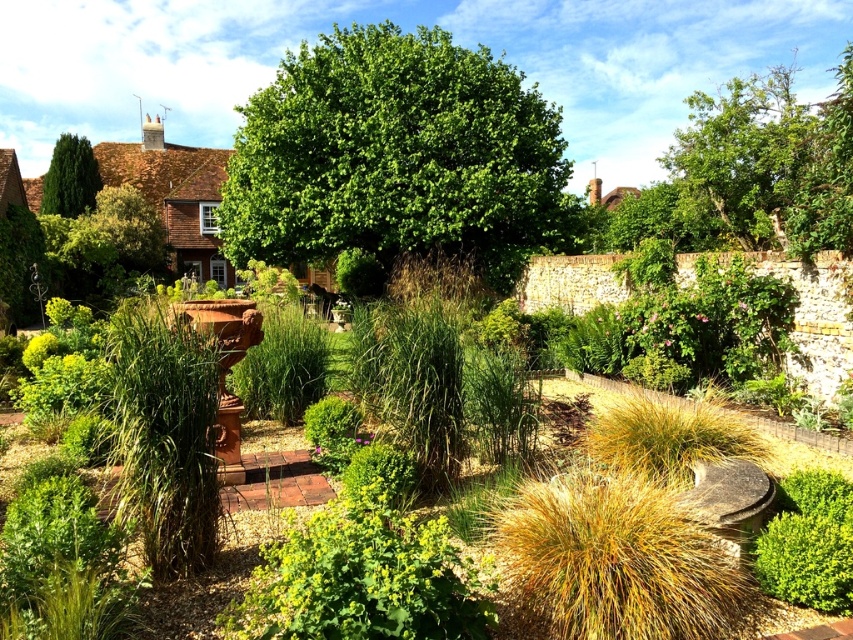
Question: Where is green leafy tree at center located in relation to green glossy tree at upper left in the image?

Choices:
 (A) below
 (B) above

Answer: (A)

Question: Which point is closer to the camera taking this photo?

Choices:
 (A) (462, 234)
 (B) (851, 486)
 (C) (62, 164)

Answer: (B)

Question: Which object is the farthest from the green leafy bush at lower right?

Choices:
 (A) green glossy tree at upper left
 (B) green leafy tree at center

Answer: (A)

Question: Does green leafy tree at center have a lesser width compared to green leafy bush at lower right?

Choices:
 (A) no
 (B) yes

Answer: (A)

Question: Is green leafy tree at center below green glossy tree at upper left?

Choices:
 (A) yes
 (B) no

Answer: (A)

Question: Estimate the real-world distances between objects in this image. Which object is farther from the green glossy tree at upper left?

Choices:
 (A) green leafy bush at lower right
 (B) green leafy tree at center

Answer: (A)